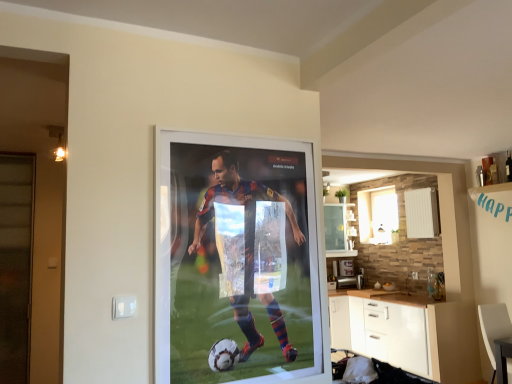
Question: Does point (349, 322) appear closer or farther from the camera than point (482, 306)?

Choices:
 (A) farther
 (B) closer

Answer: (A)

Question: In the image, is white matte cabinet at lower right positioned in front of or behind white leather armchair at lower right?

Choices:
 (A) behind
 (B) front

Answer: (A)

Question: Based on their relative distances, which object is nearer to the white frosted glass window at upper right?

Choices:
 (A) translucent glass screen door at left
 (B) white matte cabinet at lower right
 (C) white leather armchair at lower right

Answer: (B)

Question: Which is nearer to the white matte cabinet at lower right?

Choices:
 (A) white frosted glass window at upper right
 (B) translucent glass screen door at left
 (C) white leather armchair at lower right

Answer: (C)